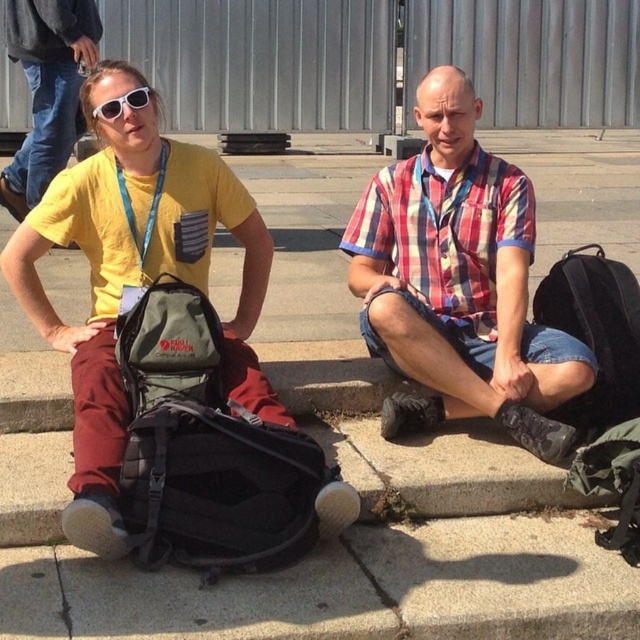
Question: Which of the following is the closest to the observer?

Choices:
 (A) matte yellow t-shirt at center
 (B) white matte sunglasses at upper left
 (C) matte black backpack at center

Answer: (A)

Question: Which of the following is the closest to the observer?

Choices:
 (A) (260, 444)
 (B) (152, 92)
 (C) (22, 4)
 (D) (506, 420)

Answer: (A)

Question: Is matte yellow t-shirt at center wider than matte black backpack at center?

Choices:
 (A) no
 (B) yes

Answer: (B)

Question: Is yellow matte t-shirt at left positioned before white matte sunglasses at upper left?

Choices:
 (A) no
 (B) yes

Answer: (A)

Question: Which of the following is the closest to the observer?

Choices:
 (A) yellow matte t-shirt at left
 (B) matte yellow t-shirt at center

Answer: (B)

Question: Where is yellow matte t-shirt at left located in relation to white matte sunglasses at upper left in the image?

Choices:
 (A) left
 (B) right

Answer: (A)